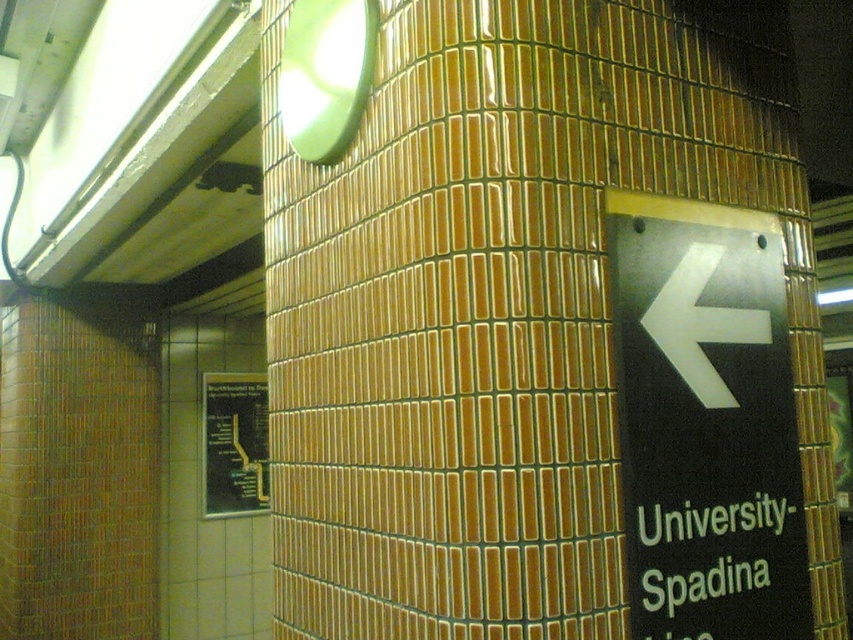
Who is more distant from viewer, (717, 275) or (788, 566)?

Positioned behind is point (788, 566).

Where is `black plastic sign at right`? This screenshot has width=853, height=640. black plastic sign at right is located at coordinates (705, 420).

You are a GUI agent. You are given a task and a screenshot of the screen. Output one action in this format:
    pyautogui.click(x=<x>, y=<y>)
    Task: Click on the black plastic sign at right
    The height and width of the screenshot is (640, 853).
    Given the screenshot: What is the action you would take?
    pyautogui.click(x=705, y=420)

Does green matte sign at lower right appear on the right side of black glossy map at lower left?

Yes, green matte sign at lower right is to the right of black glossy map at lower left.

Is green matte sign at lower right above black glossy map at lower left?

Yes.

Where is `green matte sign at lower right`? This screenshot has width=853, height=640. green matte sign at lower right is located at coordinates (718, 556).

Where is `black plastic sign at right`? black plastic sign at right is located at coordinates tap(705, 420).

Where is `black plastic sign at right`? This screenshot has width=853, height=640. black plastic sign at right is located at coordinates (705, 420).

The height and width of the screenshot is (640, 853). Find the location of `black plastic sign at right`. black plastic sign at right is located at coordinates (705, 420).